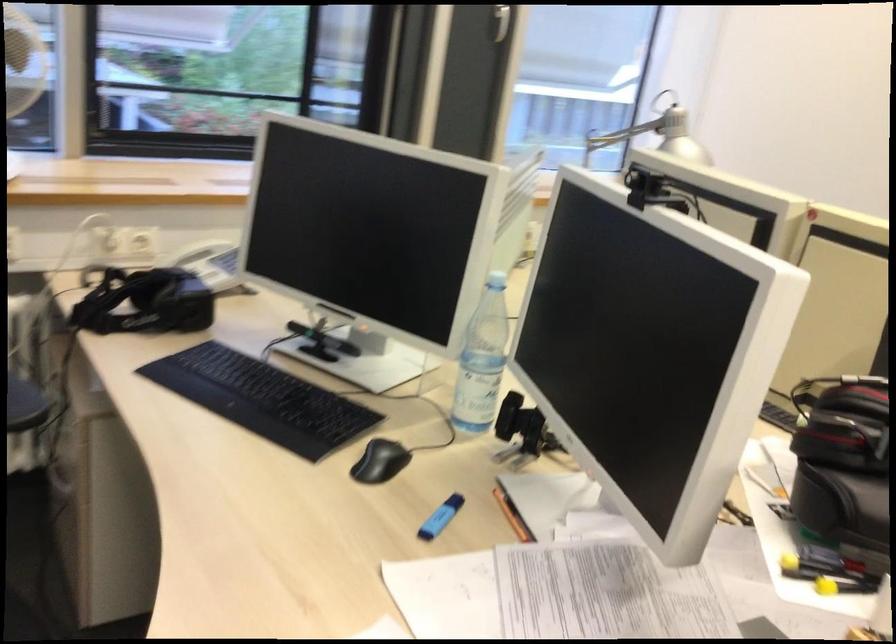
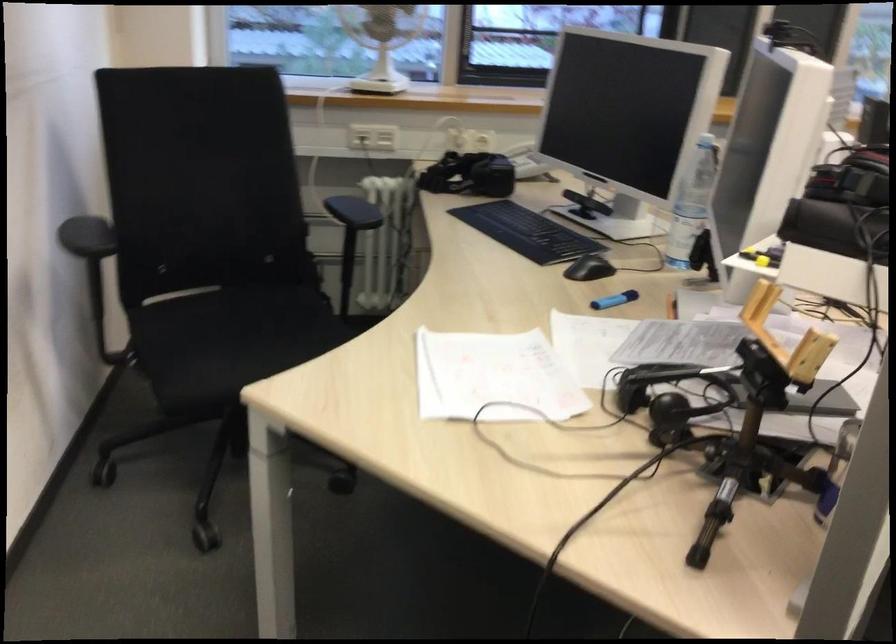
Find the pixel in the second image that matches the point at 441,516 in the first image.

(615, 299)